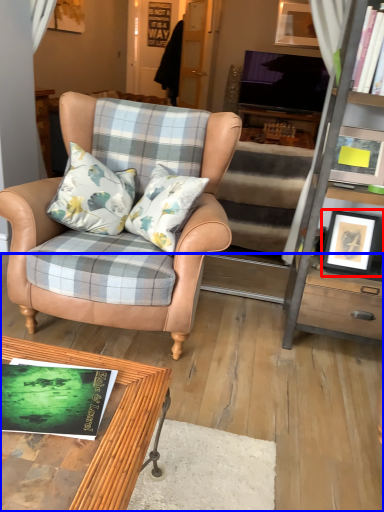
Question: Which point is further to the camera, picture frame (highlighted by a red box) or carpets (highlighted by a blue box)?

Choices:
 (A) picture frame
 (B) carpets

Answer: (A)